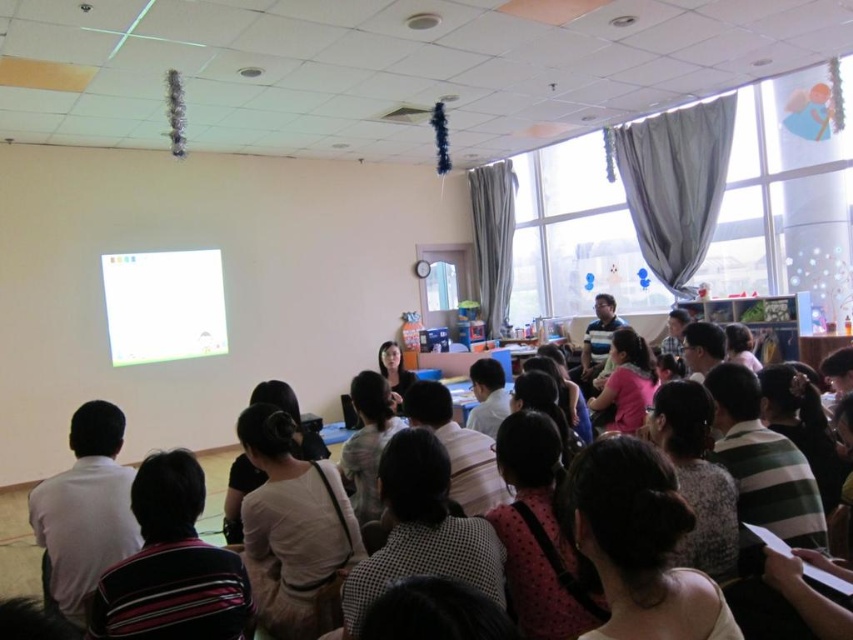
You are a person with a height of 5 feet 6 inches. You are standing in the classroom and want to see the white glossy projector screen at upper left from your current position near the white shirt at center. Is the screen visible to you without any obstruction?

The distance between you and the white glossy projector screen at upper left is 15.15 feet, which is sufficient for visibility. Since there are no mentioned obstructions in the scene description, the screen should be visible.

You are standing at the back of the classroom and want to see the presentation on the white glossy projector screen at upper left. There is a person wearing a white shirt at center blocking your view. Can you see the screen by moving to the left side of the person?

The white shirt at center is positioned on the right side of the white glossy projector screen at upper left. Therefore, moving to the left side of the person wearing the white shirt at center would allow you to see around them to view the screen.